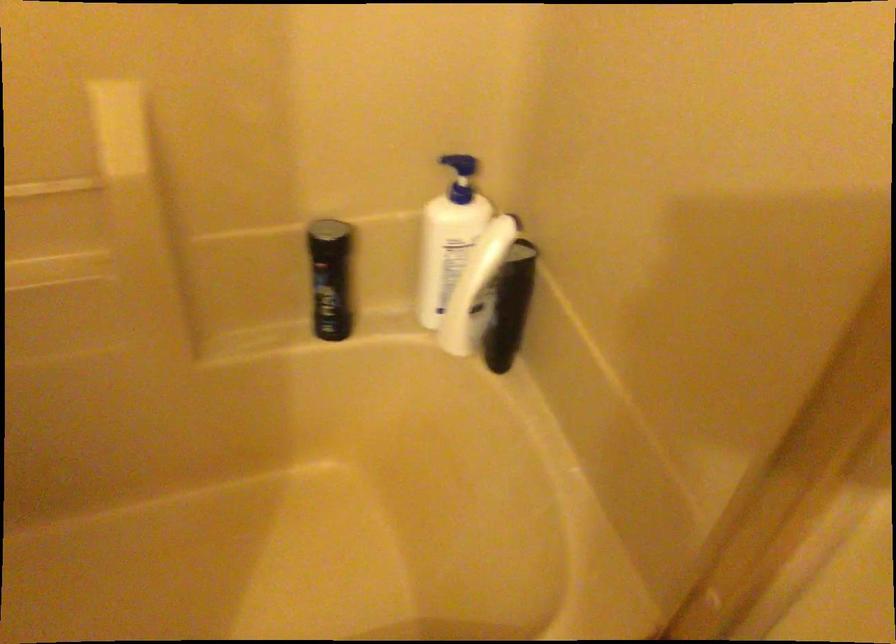
Describe the element at coordinates (330, 278) in the screenshot. I see `the black bottle cap` at that location.